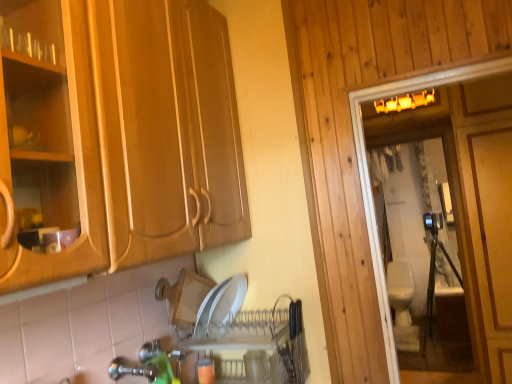
Question: Does white glossy toilet at right appear on the left side of green plastic faucet at lower center?

Choices:
 (A) yes
 (B) no

Answer: (B)

Question: Is white glossy toilet at right at the right side of green plastic faucet at lower center?

Choices:
 (A) yes
 (B) no

Answer: (A)

Question: From the image's perspective, is white glossy toilet at right on green plastic faucet at lower center?

Choices:
 (A) no
 (B) yes

Answer: (B)

Question: Is white glossy toilet at right bigger than green plastic faucet at lower center?

Choices:
 (A) yes
 (B) no

Answer: (A)

Question: Is white glossy toilet at right oriented away from green plastic faucet at lower center?

Choices:
 (A) no
 (B) yes

Answer: (A)

Question: From a real-world perspective, relative to green plastic faucet at lower center, is beige ceramic toilet at right vertically above or below?

Choices:
 (A) below
 (B) above

Answer: (A)

Question: In the image, is beige ceramic toilet at right on the left side or the right side of green plastic faucet at lower center?

Choices:
 (A) left
 (B) right

Answer: (B)

Question: Relative to green plastic faucet at lower center, is beige ceramic toilet at right in front or behind?

Choices:
 (A) front
 (B) behind

Answer: (B)

Question: From the image's perspective, relative to green plastic faucet at lower center, is beige ceramic toilet at right above or below?

Choices:
 (A) above
 (B) below

Answer: (B)

Question: Is point (444, 375) closer or farther from the camera than point (409, 266)?

Choices:
 (A) closer
 (B) farther

Answer: (A)

Question: Considering the positions of white glossy toilet at right and beige ceramic toilet at right in the image, is white glossy toilet at right bigger or smaller than beige ceramic toilet at right?

Choices:
 (A) big
 (B) small

Answer: (B)

Question: From a real-world perspective, relative to beige ceramic toilet at right, is white glossy toilet at right vertically above or below?

Choices:
 (A) below
 (B) above

Answer: (B)

Question: Considering the positions of white glossy toilet at right and beige ceramic toilet at right in the image, is white glossy toilet at right taller or shorter than beige ceramic toilet at right?

Choices:
 (A) tall
 (B) short

Answer: (A)

Question: In terms of width, does beige ceramic toilet at right look wider or thinner when compared to white glossy toilet at right?

Choices:
 (A) thin
 (B) wide

Answer: (B)

Question: In the image, is beige ceramic toilet at right on the left side or the right side of white glossy toilet at right?

Choices:
 (A) right
 (B) left

Answer: (A)